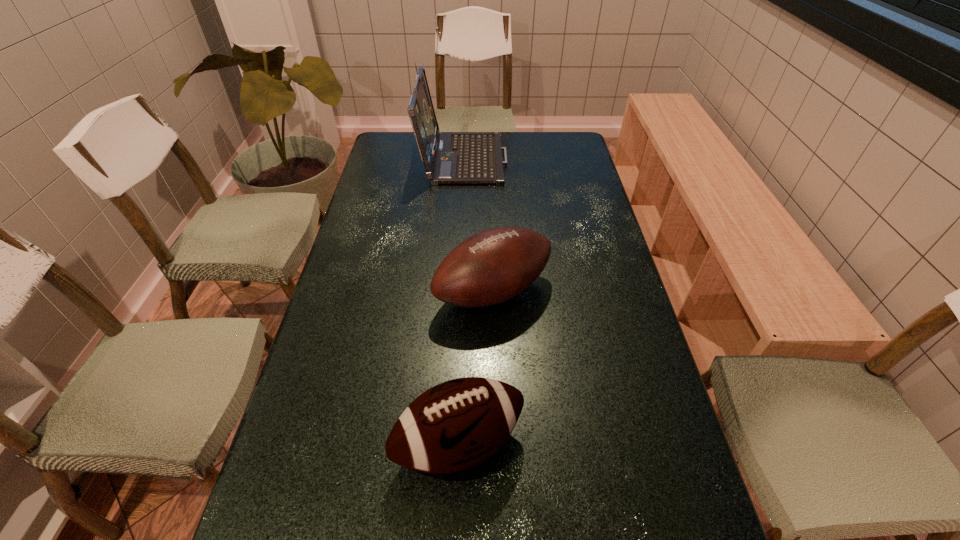
At what (x,y) coordinates should I click in order to perform the action: click on vacant space at the right edge. Please return your answer as a coordinate pair (x, y). Looking at the image, I should click on (582, 193).

At what (x,y) coordinates should I click in order to perform the action: click on vacant space at the far left corner of the desktop. Please return your answer as a coordinate pair (x, y). Image resolution: width=960 pixels, height=540 pixels. Looking at the image, I should click on (382, 142).

Where is `free region at the far right corner of the desktop`? The width and height of the screenshot is (960, 540). free region at the far right corner of the desktop is located at coordinates (545, 135).

At what (x,y) coordinates should I click in order to perform the action: click on vacant point located between the second nearest object and the laptop computer. Please return your answer as a coordinate pair (x, y). This screenshot has width=960, height=540. Looking at the image, I should click on (478, 224).

Identify the location of vacant space in between the nearest object and the second nearest object. (476, 368).

I want to click on vacant space that's between the farther football (American) and the nearer football (American), so click(476, 368).

Find the location of a particular element. free spot between the nearest object and the farther football (American) is located at coordinates (476, 368).

Image resolution: width=960 pixels, height=540 pixels. Identify the location of vacant point located between the second farthest object and the nearest object. (476, 368).

Find the location of a particular element. This screenshot has height=540, width=960. free space between the farther football (American) and the tallest object is located at coordinates (478, 224).

Identify the location of vacant area that lies between the farther football (American) and the laptop computer. The width and height of the screenshot is (960, 540). (478, 224).